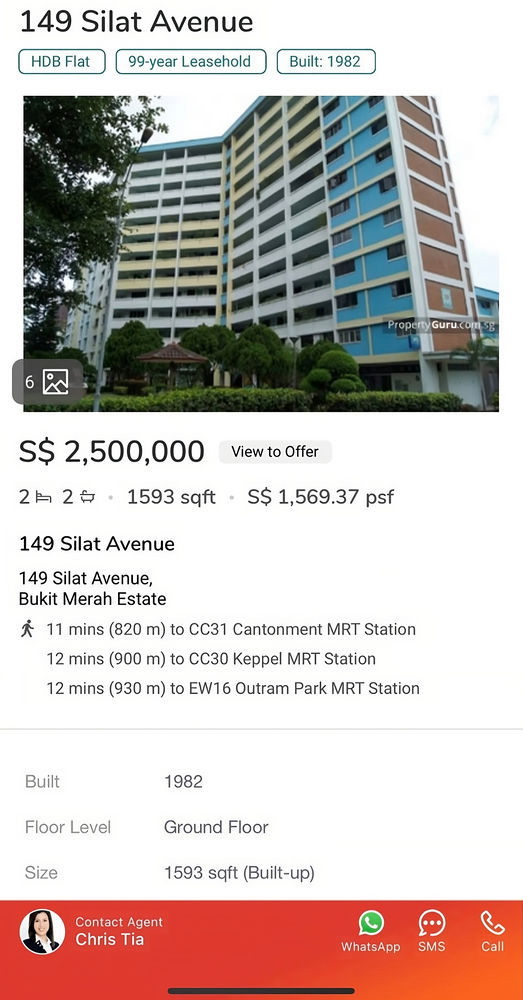
Locate an element on the screen. Image resolution: width=523 pixels, height=1000 pixels. call button is located at coordinates (493, 917).